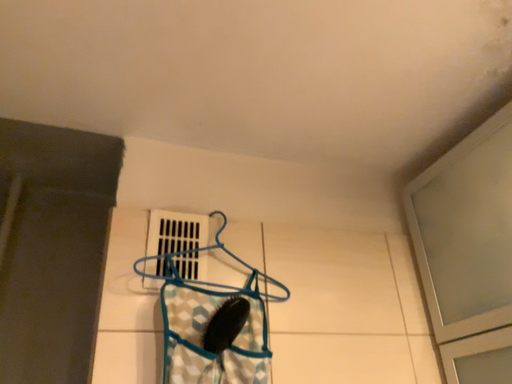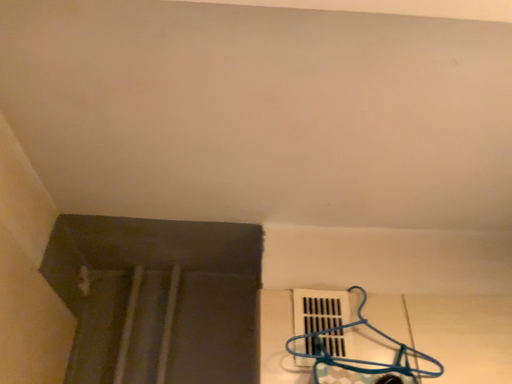
Question: Which way did the camera rotate in the video?

Choices:
 (A) rotated upward
 (B) rotated downward

Answer: (A)